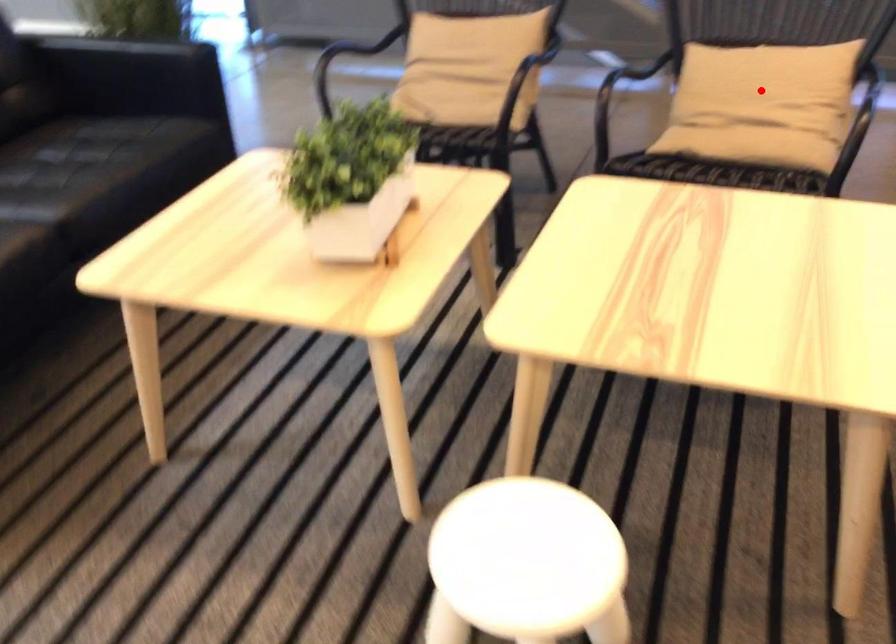
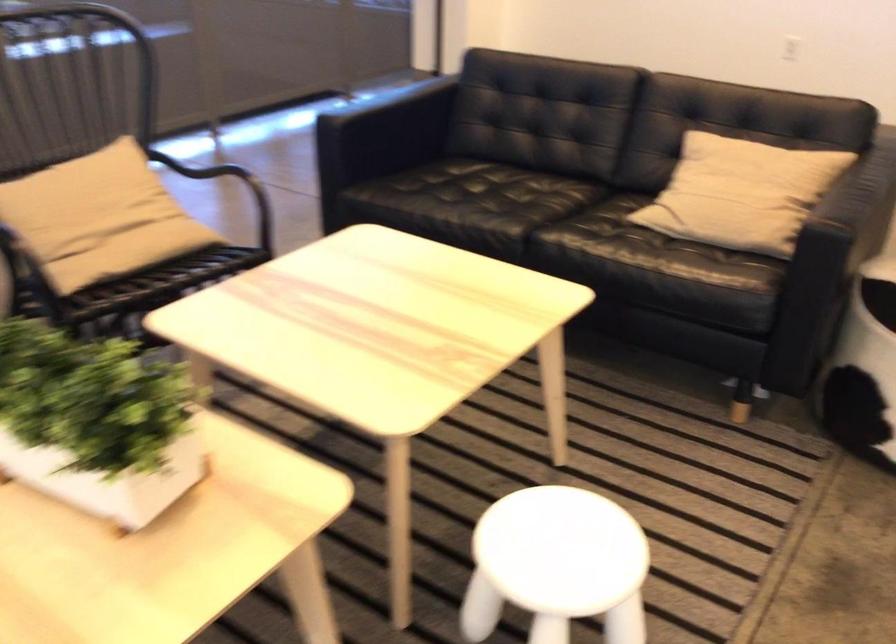
The point at the highlighted location is marked in the first image. Where is the corresponding point in the second image?

(99, 214)